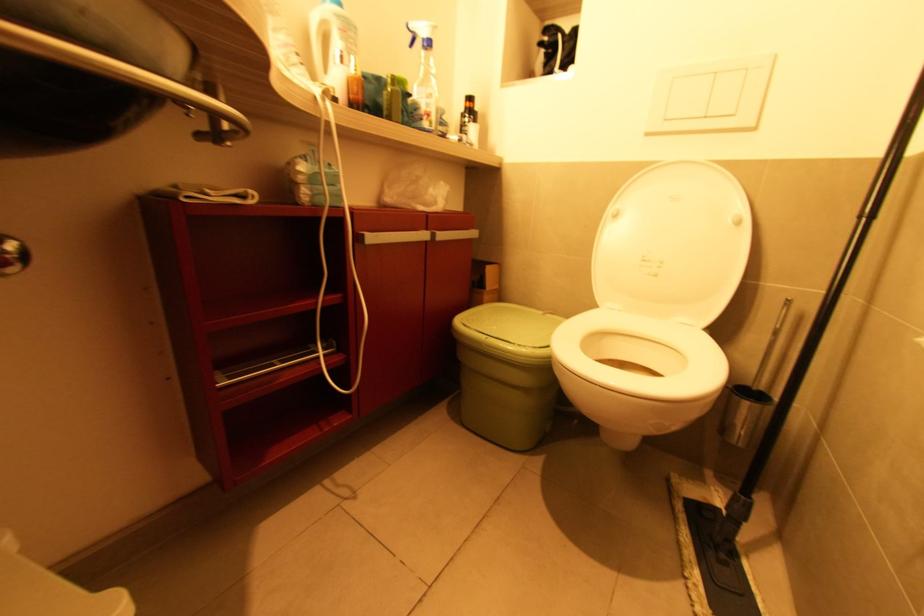
Describe the element at coordinates (710, 95) in the screenshot. Image resolution: width=924 pixels, height=616 pixels. I see `a white flush button` at that location.